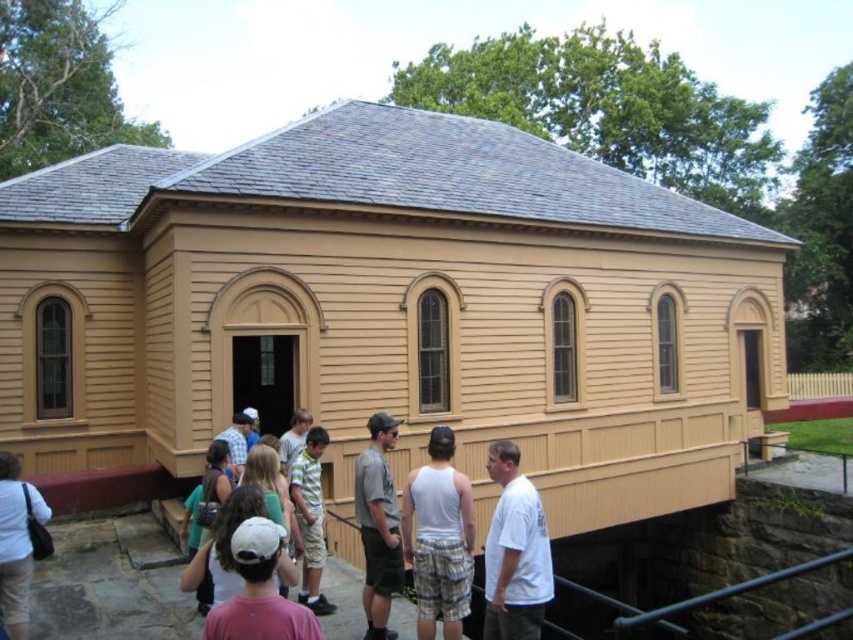
Between white cotton shirt at lower left and white cotton cap at center, which one appears on the right side from the viewer's perspective?

Positioned to the right is white cotton cap at center.

Locate an element on the screen. white cotton shirt at lower left is located at coordinates [16, 544].

I want to click on white cotton shirt at lower left, so click(x=16, y=544).

Identify the location of white cotton shirt at lower left. The image size is (853, 640). (16, 544).

Between point (585, 356) and point (375, 422), which one is positioned behind?

The point (585, 356) is more distant.

Where is `matte wood chapel at center`? This screenshot has width=853, height=640. matte wood chapel at center is located at coordinates (389, 308).

Between pink cotton shirt at lower center and white cotton cap at center, which one appears on the left side from the viewer's perspective?

From the viewer's perspective, white cotton cap at center appears more on the left side.

Is point (233, 548) positioned behind point (276, 493)?

No.

What do you see at coordinates (258, 592) in the screenshot?
I see `pink cotton shirt at lower center` at bounding box center [258, 592].

You are a GUI agent. You are given a task and a screenshot of the screen. Output one action in this format:
    pyautogui.click(x=<x>, y=<y>)
    Task: Click on the pink cotton shirt at lower center
    
    Given the screenshot: What is the action you would take?
    pyautogui.click(x=258, y=592)